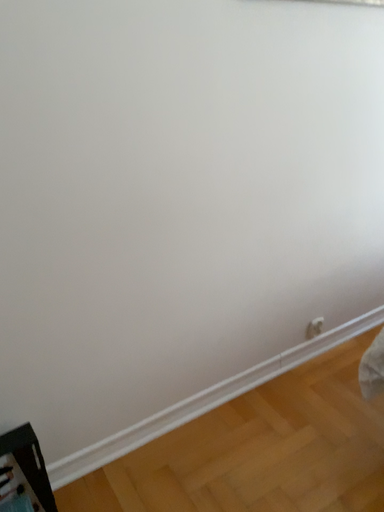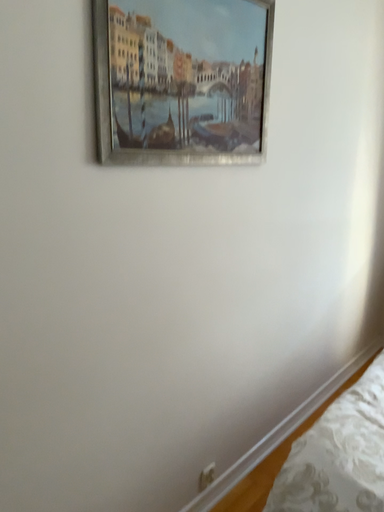
Question: Which way did the camera rotate in the video?

Choices:
 (A) rotated downward
 (B) rotated upward

Answer: (B)